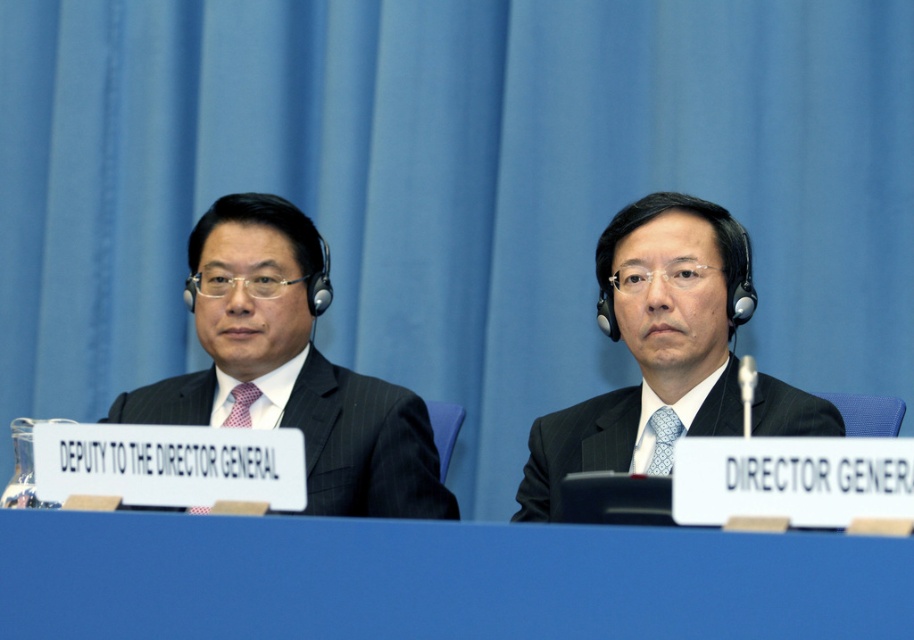
Question: Among these points, which one is farthest from the camera?

Choices:
 (A) (639, 221)
 (B) (39, 572)
 (C) (661, 472)

Answer: (A)

Question: Can you confirm if blue plastic table at center is positioned below red checkered tie at left?

Choices:
 (A) yes
 (B) no

Answer: (A)

Question: Can you confirm if red checkered tie at left is bigger than pink woven tie at left?

Choices:
 (A) no
 (B) yes

Answer: (B)

Question: Which object is the farthest from the red checkered tie at left?

Choices:
 (A) matte black suit at center
 (B) blue printed tie at center
 (C) dark gray pinstripe suit at left

Answer: (B)

Question: Considering the real-world distances, which object is closest to the dark gray pinstripe suit at left?

Choices:
 (A) blue plastic table at center
 (B) red checkered tie at left
 (C) blue printed tie at center

Answer: (B)

Question: Is blue plastic table at center above red checkered tie at left?

Choices:
 (A) yes
 (B) no

Answer: (B)